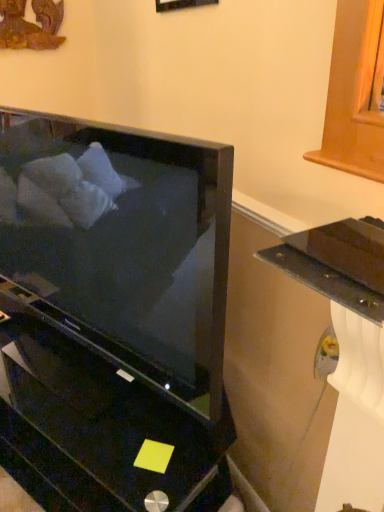
At what (x,y) coordinates should I click in order to perform the action: click on satin black tv at center. Please return your answer as a coordinate pair (x, y). The height and width of the screenshot is (512, 384). Looking at the image, I should click on (113, 315).

What do you see at coordinates (113, 315) in the screenshot? I see `satin black tv at center` at bounding box center [113, 315].

What is the approximate width of satin black tv at center?

satin black tv at center is 7.71 inches in width.

Identify the location of wooden picture frame at upper center. (181, 4).

This screenshot has width=384, height=512. What do you see at coordinates (181, 4) in the screenshot?
I see `wooden picture frame at upper center` at bounding box center [181, 4].

Locate an element on the screen. The height and width of the screenshot is (512, 384). satin black tv at center is located at coordinates (113, 315).

Visually, is wooden picture frame at upper center positioned to the left or to the right of satin black tv at center?

From the image, it's evident that wooden picture frame at upper center is to the right of satin black tv at center.

Is the depth of wooden picture frame at upper center less than that of satin black tv at center?

No, the depth of wooden picture frame at upper center is greater than that of satin black tv at center.

Is point (210, 3) in front of point (135, 429)?

That is True.

From the image's perspective, relative to satin black tv at center, is wooden picture frame at upper center above or below?

wooden picture frame at upper center is above satin black tv at center.

From a real-world perspective, is wooden picture frame at upper center physically below satin black tv at center?

No.

Is wooden picture frame at upper center wider or thinner than satin black tv at center?

Clearly, wooden picture frame at upper center has less width compared to satin black tv at center.

Who is taller, wooden picture frame at upper center or satin black tv at center?

satin black tv at center is taller.

Can you confirm if wooden picture frame at upper center is smaller than satin black tv at center?

A: Indeed, wooden picture frame at upper center has a smaller size compared to satin black tv at center.

Which is correct: wooden picture frame at upper center is inside satin black tv at center, or outside of it?

wooden picture frame at upper center is not enclosed by satin black tv at center.

Is wooden picture frame at upper center far from satin black tv at center?

No, wooden picture frame at upper center is not far from satin black tv at center.

Is wooden picture frame at upper center turned away from satin black tv at center?

No.

Can you tell me how much wooden picture frame at upper center and satin black tv at center differ in facing direction?

They differ by 22.2 degrees in their facing directions.

How distant is wooden picture frame at upper center from satin black tv at center?

wooden picture frame at upper center and satin black tv at center are 34.82 inches apart.

Where is `furniture that is in front of the wooden picture frame at upper center`? furniture that is in front of the wooden picture frame at upper center is located at coordinates (113, 315).

Considering the relative positions of satin black tv at center and wooden picture frame at upper center in the image provided, is satin black tv at center to the right of wooden picture frame at upper center from the viewer's perspective?

In fact, satin black tv at center is to the left of wooden picture frame at upper center.

Who is more distant, satin black tv at center or wooden picture frame at upper center?

wooden picture frame at upper center is more distant.

Is point (11, 428) closer or farther from the camera than point (173, 3)?

Point (11, 428) is positioned farther from the camera compared to point (173, 3).

From the image's perspective, would you say satin black tv at center is positioned over wooden picture frame at upper center?

No, from the image's perspective, satin black tv at center is not over wooden picture frame at upper center.

From a real-world perspective, which object stands above the other?

wooden picture frame at upper center, from a real-world perspective.

Which object is wider, satin black tv at center or wooden picture frame at upper center?

satin black tv at center is wider.

Can you confirm if satin black tv at center is shorter than wooden picture frame at upper center?

Incorrect, the height of satin black tv at center does not fall short of that of wooden picture frame at upper center.

Can you confirm if satin black tv at center is bigger than wooden picture frame at upper center?

Yes.

Is satin black tv at center positioned beyond the bounds of wooden picture frame at upper center?

satin black tv at center is positioned outside wooden picture frame at upper center.

Based on the photo, is satin black tv at center not near wooden picture frame at upper center?

No, satin black tv at center is not far away from wooden picture frame at upper center.

In the scene shown: Is satin black tv at center aimed at wooden picture frame at upper center?

No, satin black tv at center is not facing towards wooden picture frame at upper center.

How many degrees apart are the facing directions of satin black tv at center and wooden picture frame at upper center?

The angular difference between satin black tv at center and wooden picture frame at upper center is 22.2 degrees.

How far apart are satin black tv at center and wooden picture frame at upper center?

satin black tv at center and wooden picture frame at upper center are 34.82 inches apart from each other.

Locate an element on the screen. The height and width of the screenshot is (512, 384). furniture that is below the wooden picture frame at upper center (from the image's perspective) is located at coordinates (113, 315).

Find the location of a particular element. The height and width of the screenshot is (512, 384). furniture in front of the wooden picture frame at upper center is located at coordinates (113, 315).

Where is `furniture below the wooden picture frame at upper center (from a real-world perspective)`? This screenshot has height=512, width=384. furniture below the wooden picture frame at upper center (from a real-world perspective) is located at coordinates (113, 315).